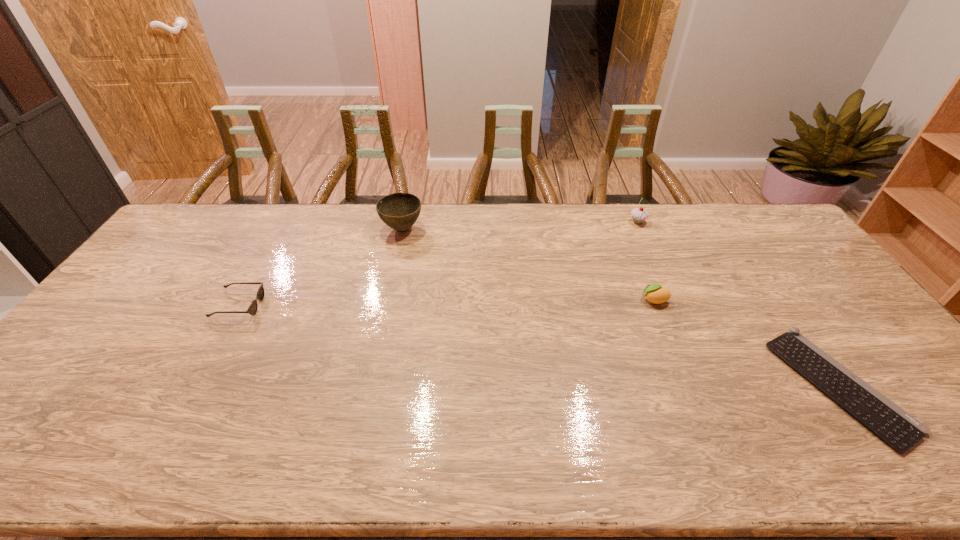
Locate an element on the screen. The height and width of the screenshot is (540, 960). the fourth object from right to left is located at coordinates (399, 211).

Where is `cupcake`? The height and width of the screenshot is (540, 960). cupcake is located at coordinates (639, 215).

At what (x,y) coordinates should I click in order to perform the action: click on the third shortest object. Please return your answer as a coordinate pair (x, y). This screenshot has height=540, width=960. Looking at the image, I should click on (656, 294).

This screenshot has width=960, height=540. Identify the location of the leftmost object. (252, 309).

Identify the location of sunglasses. The height and width of the screenshot is (540, 960). (252, 309).

Locate an element on the screen. The image size is (960, 540). the shortest object is located at coordinates (899, 429).

Image resolution: width=960 pixels, height=540 pixels. I want to click on computer keyboard, so click(x=899, y=429).

Where is `free space located 0.080m on the right of the bowl`? The image size is (960, 540). free space located 0.080m on the right of the bowl is located at coordinates (446, 228).

Where is `free location located 0.070m on the back of the cupcake`? free location located 0.070m on the back of the cupcake is located at coordinates (631, 206).

The height and width of the screenshot is (540, 960). What are the coordinates of `vacant space located 0.130m with leaves positioned above the lemon` in the screenshot? It's located at (595, 300).